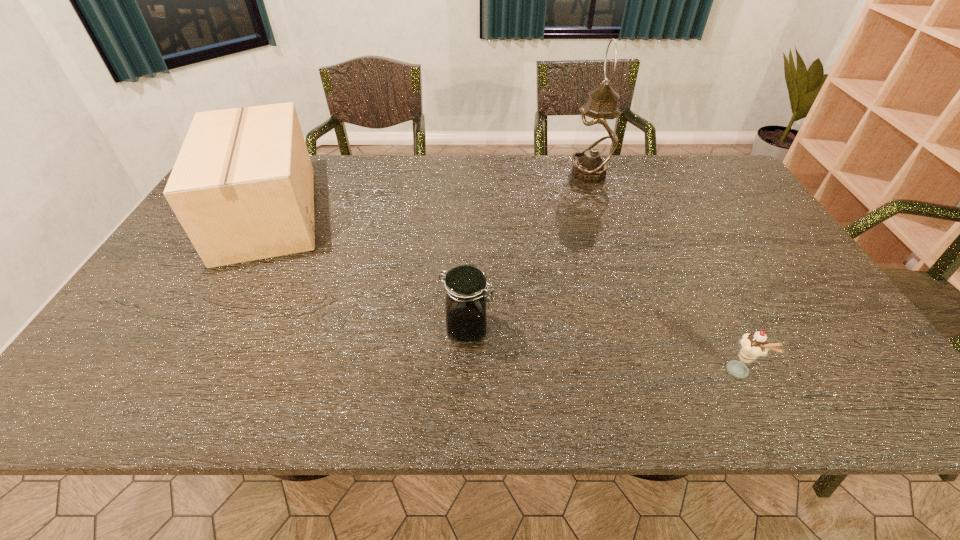
Locate which object ranks second in proximity to the third farthest object. Please provide its 2D coordinates. Your answer should be formatted as a tuple, i.e. [(x, y)], where the tuple contains the x and y coordinates of a point satisfying the conditions above.

[(755, 345)]

Identify which object is located as the third nearest to the tallest object. Please provide its 2D coordinates. Your answer should be formatted as a tuple, i.e. [(x, y)], where the tuple contains the x and y coordinates of a point satisfying the conditions above.

[(242, 187)]

Locate an element on the screen. free location that satisfies the following two spatial constraints: 1. on the back side of the oil lamp; 2. on the right side of the leftmost object is located at coordinates (289, 174).

Where is `free space that satisfies the following two spatial constraints: 1. on the front side of the second object from right to left; 2. on the lid of the second object from left to right`? The width and height of the screenshot is (960, 540). free space that satisfies the following two spatial constraints: 1. on the front side of the second object from right to left; 2. on the lid of the second object from left to right is located at coordinates (638, 328).

Where is `vacant space that satisfies the following two spatial constraints: 1. on the lid of the rightmost object; 2. on the right side of the jar`? The image size is (960, 540). vacant space that satisfies the following two spatial constraints: 1. on the lid of the rightmost object; 2. on the right side of the jar is located at coordinates (467, 372).

Where is `free space that satisfies the following two spatial constraints: 1. on the back side of the rightmost object; 2. on the lid of the jar`? This screenshot has height=540, width=960. free space that satisfies the following two spatial constraints: 1. on the back side of the rightmost object; 2. on the lid of the jar is located at coordinates (718, 328).

Image resolution: width=960 pixels, height=540 pixels. What are the coordinates of `free space that satisfies the following two spatial constraints: 1. on the lid of the icecream; 2. on the right side of the third farthest object` in the screenshot? It's located at (467, 372).

Where is `vacant space that satisfies the following two spatial constraints: 1. on the back side of the nearest object; 2. on the lid of the third farthest object`? This screenshot has width=960, height=540. vacant space that satisfies the following two spatial constraints: 1. on the back side of the nearest object; 2. on the lid of the third farthest object is located at coordinates (718, 328).

I want to click on blank space that satisfies the following two spatial constraints: 1. on the front side of the nearest object; 2. on the left side of the third shortest object, so click(178, 372).

Image resolution: width=960 pixels, height=540 pixels. What are the coordinates of `vacant area in the image that satisfies the following two spatial constraints: 1. on the lid of the second nearest object; 2. on the right side of the nearest object` in the screenshot? It's located at (x=467, y=372).